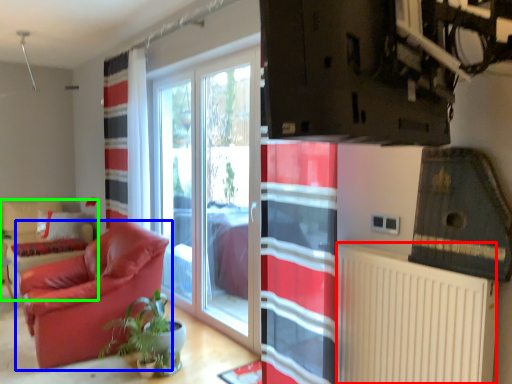
Question: Which object is positioned closest to radiator (highlighted by a red box)? Select from chair (highlighted by a blue box) and armchair (highlighted by a green box).

Choices:
 (A) chair
 (B) armchair

Answer: (A)